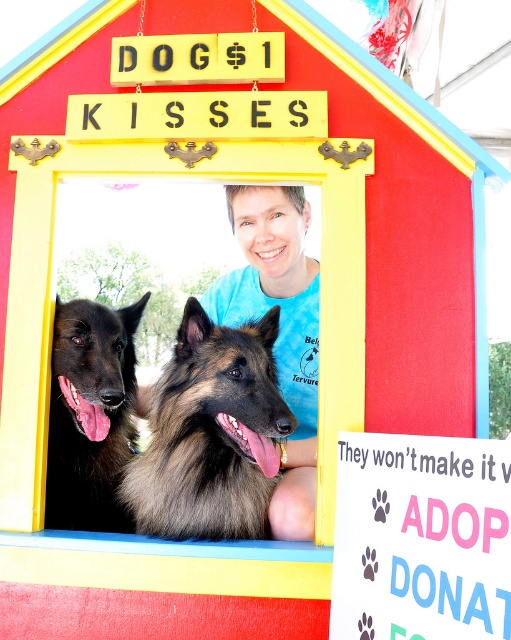
You are a visitor at the booth and want to pet the black fur dog at center. However, there is a blue cotton shirt at center in the way. Can you reach the dog without moving the shirt?

The blue cotton shirt at center is positioned over black fur dog at center, so you cannot reach the dog without moving the shirt.

You are a customer standing in front of the booth and see the blue cotton shirt at center and the black fur dog at center. Which item is taller?

The blue cotton shirt at center is taller than the black fur dog at center.

You are a visitor at the booth and want to pet both dogs. Which dog should you reach up to pet first, the brown shaggy dog at center or the black fur dog at center?

The black fur dog at center is higher up than the brown shaggy dog at center, so you should reach up to pet the black fur dog at center first.